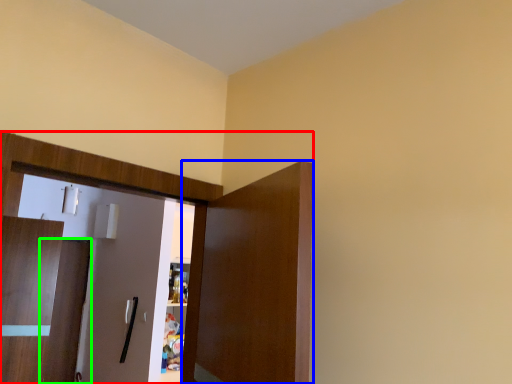
Question: Which object is positioned closest to dresser (highlighted by a red box)? Select from door (highlighted by a blue box) and door (highlighted by a green box).

Choices:
 (A) door
 (B) door

Answer: (A)